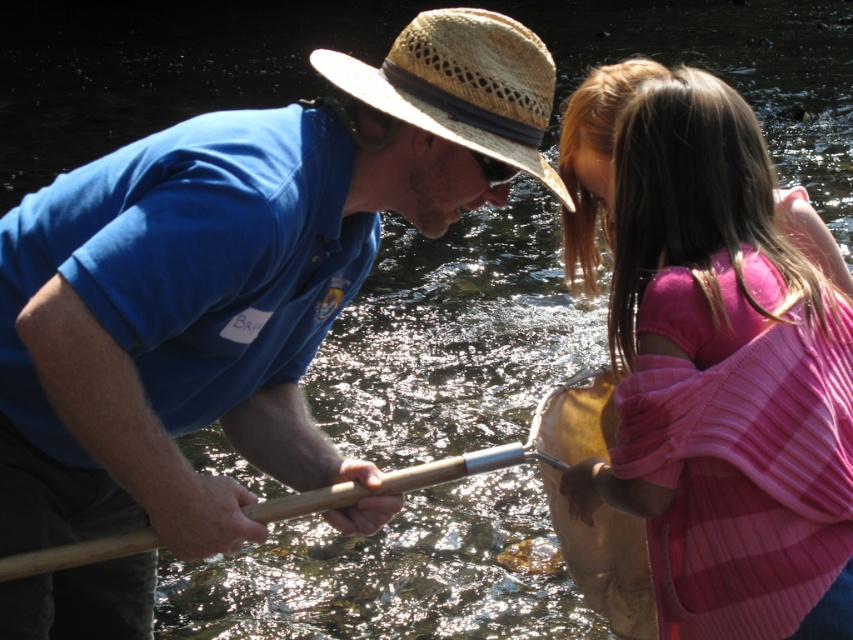
Between point (798, 577) and point (550, 54), which one is positioned in front?

Point (798, 577) is more forward.

Can you confirm if pink ribbed sweater at upper right is taller than straw hat at center?

Indeed, pink ribbed sweater at upper right has a greater height compared to straw hat at center.

Is point (779, 250) closer to camera compared to point (399, 64)?

No.

At what (x,y) coordinates should I click in order to perform the action: click on pink ribbed sweater at upper right. Please return your answer as a coordinate pair (x, y). The height and width of the screenshot is (640, 853). Looking at the image, I should click on (718, 372).

From the picture: Who is higher up, straw hat at center or wooden paddle at center?

straw hat at center

Is point (459, 36) closer to viewer compared to point (471, 454)?

Yes, point (459, 36) is in front of point (471, 454).

Between point (428, 106) and point (407, 483), which one is positioned behind?

The point (407, 483) is behind.

Image resolution: width=853 pixels, height=640 pixels. Find the location of `straw hat at center`. straw hat at center is located at coordinates (462, 84).

Consider the image. Which is above, matte blue shirt at center or wooden paddle at center?

Positioned higher is matte blue shirt at center.

Which is behind, point (357, 122) or point (138, 545)?

Point (357, 122)

This screenshot has height=640, width=853. What do you see at coordinates (235, 280) in the screenshot?
I see `matte blue shirt at center` at bounding box center [235, 280].

You are a GUI agent. You are given a task and a screenshot of the screen. Output one action in this format:
    pyautogui.click(x=<x>, y=<y>)
    Task: Click on the matte blue shirt at center
    This screenshot has height=640, width=853.
    Given the screenshot: What is the action you would take?
    pyautogui.click(x=235, y=280)